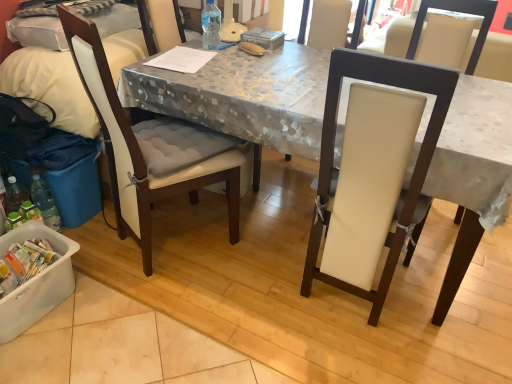
The image size is (512, 384). Describe the element at coordinates (243, 96) in the screenshot. I see `white fabric-covered desk at center` at that location.

Describe the element at coordinates (387, 84) in the screenshot. I see `white leather chair at center, which appears as the second chair when viewed from the left` at that location.

Where is `matte white chair at left`? The height and width of the screenshot is (384, 512). matte white chair at left is located at coordinates (50, 86).

From a real-world perspective, is matte white chair at left physically below white plastic container at lower left?

No, from a real-world perspective, matte white chair at left is not below white plastic container at lower left.

Is matte white chair at left positioned beyond the bounds of white plastic container at lower left?

Yes.

Considering the sizes of objects matte white chair at left and white plastic container at lower left in the image provided, who is taller, matte white chair at left or white plastic container at lower left?

matte white chair at left.

Based on the photo, is matte white chair at left wider or thinner than white plastic container at lower left?

In the image, matte white chair at left appears to be wider than white plastic container at lower left.

Who is bigger, white leather chair at center, which appears as the second chair when viewed from the left, or white plastic container at lower left?

white leather chair at center, which appears as the second chair when viewed from the left.

Considering the sizes of objects white leather chair at center, acting as the first chair starting from the right, and white plastic container at lower left in the image provided, who is wider, white leather chair at center, acting as the first chair starting from the right, or white plastic container at lower left?

With larger width is white leather chair at center, acting as the first chair starting from the right.

From their relative heights in the image, would you say white leather chair at center, which appears as the second chair when viewed from the left, is taller or shorter than white plastic container at lower left?

In the image, white leather chair at center, which appears as the second chair when viewed from the left, appears to be taller than white plastic container at lower left.

How far apart are white leather chair at center, acting as the first chair starting from the right, and white plastic container at lower left?

The distance of white leather chair at center, acting as the first chair starting from the right, from white plastic container at lower left is 1.09 meters.

Which object is thinner, white plastic container at lower left or matte white chair at left?

Thinner between the two is white plastic container at lower left.

Is white plastic container at lower left looking in the opposite direction of matte white chair at left?

No.

Is white plastic container at lower left in front of matte white chair at left?

That is True.

From the image's perspective, is white padded chair at left, the 2th chair positioned from the right, under matte white chair at left?

Yes, from the image's perspective, white padded chair at left, the 2th chair positioned from the right, is beneath matte white chair at left.

From a real-world perspective, does white padded chair at left, the first chair from the left, stand above matte white chair at left?

No, from a real-world perspective, white padded chair at left, the first chair from the left, is not over matte white chair at left

Are white padded chair at left, the 2th chair positioned from the right, and matte white chair at left beside each other?

white padded chair at left, the 2th chair positioned from the right, is not next to matte white chair at left, and they're not touching.

Considering their positions, is white padded chair at left, the first chair from the left, located in front of or behind matte white chair at left?

white padded chair at left, the first chair from the left, is positioned closer to the viewer than matte white chair at left.

Is point (22, 285) in front of point (213, 39)?

That is True.

Which object is closer to the camera taking this photo, white plastic container at lower left or transparent plastic bottle at table center?

white plastic container at lower left.

Is white plastic container at lower left taller than transparent plastic bottle at table center?

Indeed, white plastic container at lower left has a greater height compared to transparent plastic bottle at table center.

Which is correct: white plastic container at lower left is inside transparent plastic bottle at table center, or outside of it?

white plastic container at lower left is located beyond the bounds of transparent plastic bottle at table center.

From the image's perspective, is matte white chair at left located above or below white leather chair at center, which appears as the second chair when viewed from the left?

matte white chair at left is situated higher than white leather chair at center, which appears as the second chair when viewed from the left, in the image.

Is white leather chair at center, which appears as the second chair when viewed from the left, at the back of matte white chair at left?

matte white chair at left does not have its back to white leather chair at center, which appears as the second chair when viewed from the left.

In the image, is matte white chair at left positioned in front of or behind white leather chair at center, acting as the first chair starting from the right?

matte white chair at left is behind white leather chair at center, acting as the first chair starting from the right.

Does white plastic container at lower left have a smaller size compared to white fabric-covered desk at center?

Correct, white plastic container at lower left occupies less space than white fabric-covered desk at center.

Is white plastic container at lower left positioned beyond the bounds of white fabric-covered desk at center?

Yes, white plastic container at lower left is outside of white fabric-covered desk at center.

The height and width of the screenshot is (384, 512). In order to click on leftover above the white plastic container at lower left (from the image's perspective) in this screenshot , I will do `click(50, 86)`.

Locate an element on the screen. box located behind the white leather chair at center, acting as the first chair starting from the right is located at coordinates (36, 281).

When comparing their distances from white plastic container at lower left, does white leather chair at center, which appears as the second chair when viewed from the left, or white padded chair at left, the 2th chair positioned from the right, seem further?

white leather chair at center, which appears as the second chair when viewed from the left.

Looking at the image, which one is located closer to transparent plastic bottle at table center, white leather chair at center, acting as the first chair starting from the right, or white padded chair at left, the 2th chair positioned from the right?

Based on the image, white padded chair at left, the 2th chair positioned from the right, appears to be nearer to transparent plastic bottle at table center.

Looking at the image, which one is located closer to transparent plastic bottle at table center, white fabric-covered desk at center or matte white chair at left?

Based on the image, white fabric-covered desk at center appears to be nearer to transparent plastic bottle at table center.

Looking at the image, which one is located closer to white leather chair at center, acting as the first chair starting from the right, matte white chair at left or white plastic container at lower left?

white plastic container at lower left is positioned closer to the anchor white leather chair at center, acting as the first chair starting from the right.

When comparing their distances from white plastic container at lower left, does transparent plastic bottle at table center or matte white chair at left seem closer?

matte white chair at left.

Which object lies further to the anchor point white plastic container at lower left, matte white chair at left or white padded chair at left, the first chair from the left?

Based on the image, matte white chair at left appears to be further to white plastic container at lower left.

Based on their spatial positions, is matte white chair at left or white plastic container at lower left closer to white fabric-covered desk at center?

matte white chair at left is closer to white fabric-covered desk at center.

Which object lies further to the anchor point white fabric-covered desk at center, transparent plastic bottle at table center or white plastic container at lower left?

white plastic container at lower left is positioned further to the anchor white fabric-covered desk at center.

Where is `bottle between matte white chair at left and white fabric-covered desk at center`? bottle between matte white chair at left and white fabric-covered desk at center is located at coordinates (211, 26).

I want to click on chair between white plastic container at lower left and white leather chair at center, which appears as the second chair when viewed from the left, so click(x=147, y=148).

At what (x,y) coordinates should I click in order to perform the action: click on chair between white fabric-covered desk at center and transparent plastic bottle at table center from front to back. Please return your answer as a coordinate pair (x, y). Image resolution: width=512 pixels, height=384 pixels. Looking at the image, I should click on (147, 148).

Find the location of a particular element. The height and width of the screenshot is (384, 512). bottle located between white plastic container at lower left and white leather chair at center, acting as the first chair starting from the right, in the left-right direction is located at coordinates (211, 26).